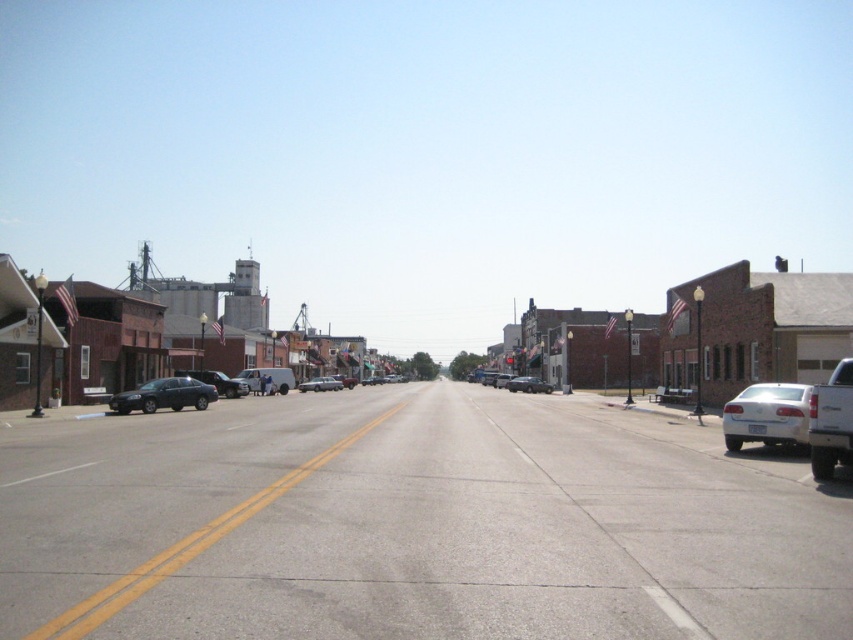
This screenshot has width=853, height=640. Describe the element at coordinates (161, 336) in the screenshot. I see `brown brick building at left` at that location.

Is brown brick building at left to the left of matte black sedan at left from the viewer's perspective?

Indeed, brown brick building at left is positioned on the left side of matte black sedan at left.

Does point (233, 314) come in front of point (126, 404)?

That is False.

Identify the location of brown brick building at left. (161, 336).

Is brown brick building at left taller than white glossy sedan at right?

Indeed, brown brick building at left has a greater height compared to white glossy sedan at right.

Based on the photo, can you confirm if brown brick building at left is bigger than white glossy sedan at right?

Yes, brown brick building at left is bigger than white glossy sedan at right.

Who is more distant from viewer, (115, 346) or (788, 403)?

The point (115, 346) is behind.

Find the location of a particular element. This screenshot has height=640, width=853. brown brick building at left is located at coordinates (161, 336).

This screenshot has width=853, height=640. What do you see at coordinates (161, 336) in the screenshot?
I see `brown brick building at left` at bounding box center [161, 336].

Is brown brick building at left taller than satin black sedan at center?

Yes.

What do you see at coordinates (161, 336) in the screenshot? I see `brown brick building at left` at bounding box center [161, 336].

The image size is (853, 640). Identify the location of brown brick building at left. (161, 336).